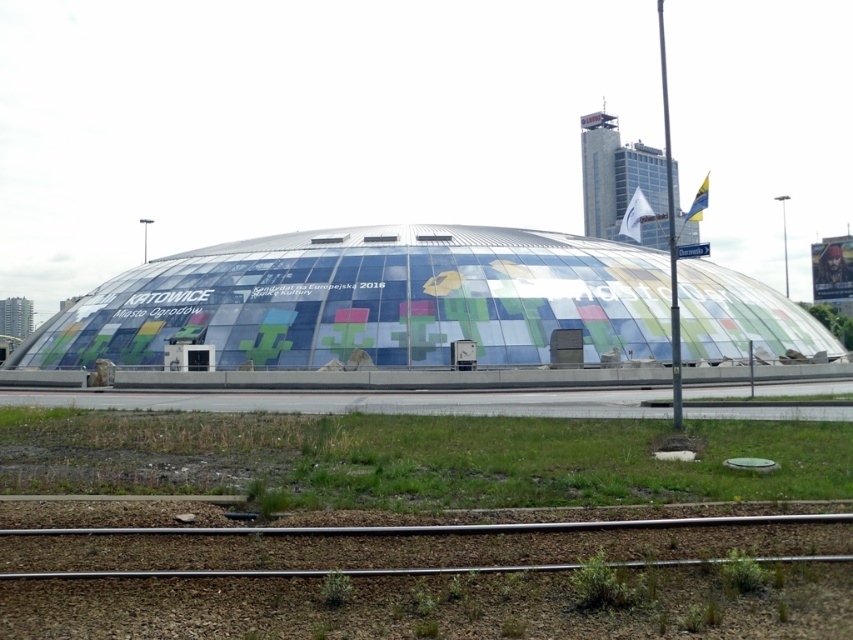
You are standing in front of the building and want to see the top of the transparent glass dome at center. Can you see it over the green grass at lower center?

Yes, because the transparent glass dome at center is taller than the green grass at lower center, so it will be visible over the grass.